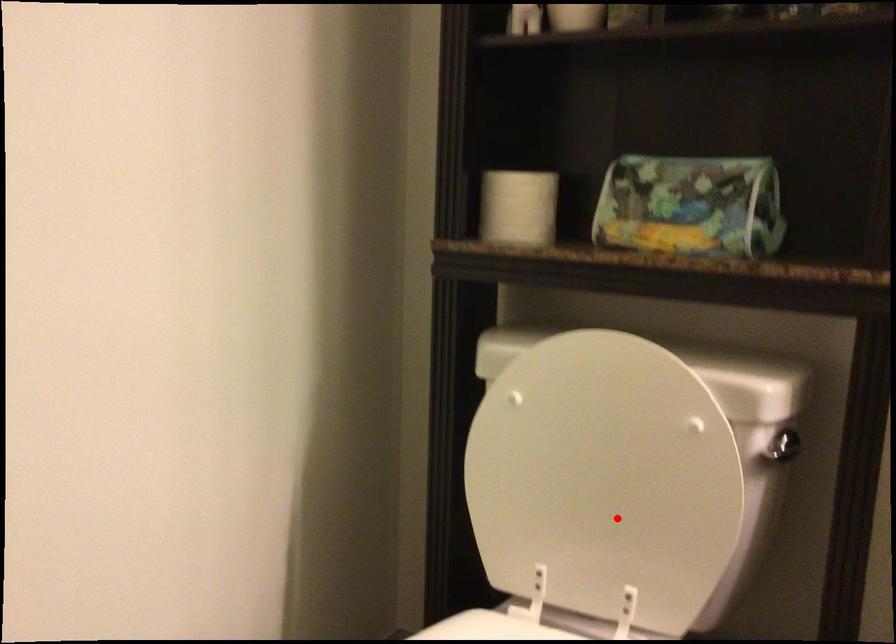
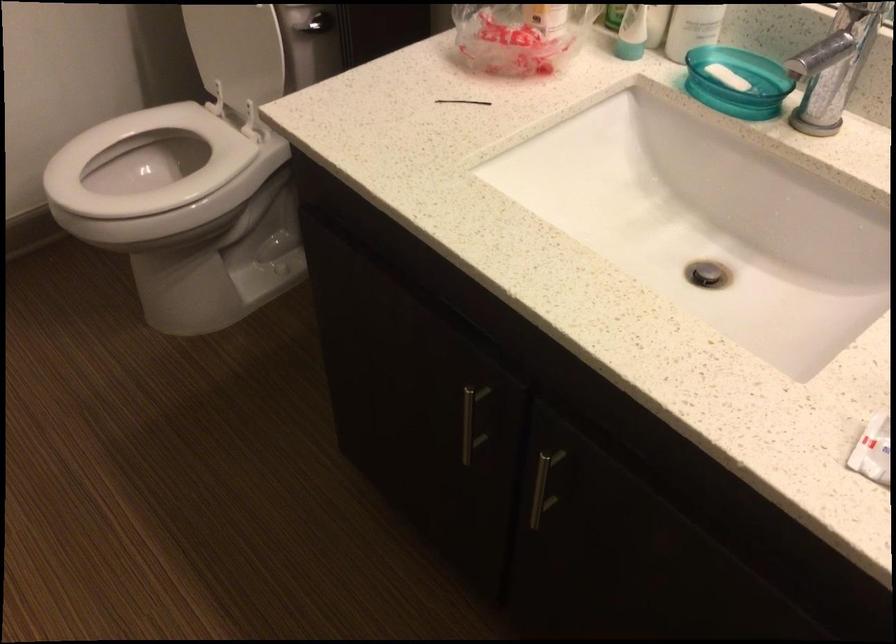
Question: A red point is marked in image1. In image2, is the corresponding 3D point closer to the camera or farther? Reply with the corresponding letter.

Choices:
 (A) The corresponding 3D point is closer.
 (B) The corresponding 3D point is farther.

Answer: (B)